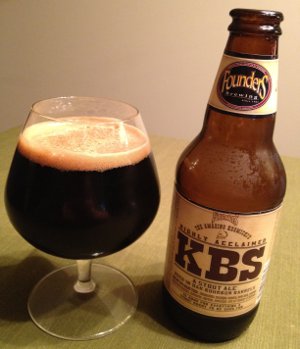
Find the location of a particular element. The height and width of the screenshot is (349, 300). glass is located at coordinates (95, 307).